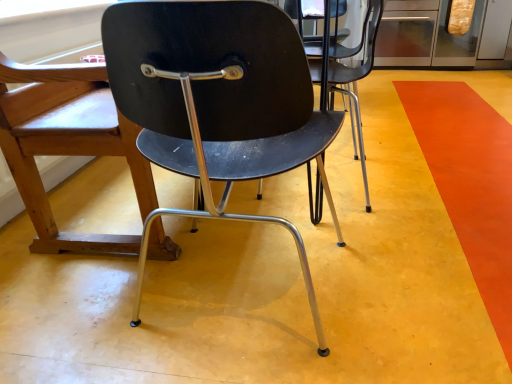
Question: Would you consider matte black chair at center, which is the 1th chair in back-to-front order, to be distant from orange matte floor at lower right?

Choices:
 (A) yes
 (B) no

Answer: (A)

Question: Is matte black chair at center, the 2th chair when ordered from front to back, positioned behind orange matte floor at lower right?

Choices:
 (A) yes
 (B) no

Answer: (A)

Question: From the image's perspective, is matte black chair at center, the 2th chair when ordered from front to back, below orange matte floor at lower right?

Choices:
 (A) yes
 (B) no

Answer: (B)

Question: Is the surface of matte black chair at center, the 2th chair when ordered from front to back, in direct contact with orange matte floor at lower right?

Choices:
 (A) no
 (B) yes

Answer: (A)

Question: Does matte black chair at center, which is the 1th chair in back-to-front order, have a larger size compared to orange matte floor at lower right?

Choices:
 (A) yes
 (B) no

Answer: (A)

Question: Is matte black chair at center, which is the 1th chair in back-to-front order, looking in the opposite direction of orange matte floor at lower right?

Choices:
 (A) no
 (B) yes

Answer: (A)

Question: Does matte black chair at center, the 2th chair from the back, appear on the right side of matte black chair at center, the 2th chair when ordered from front to back?

Choices:
 (A) no
 (B) yes

Answer: (B)

Question: Is matte black chair at center, the 1th chair viewed from the front, behind matte black chair at center, which is the 1th chair in back-to-front order?

Choices:
 (A) no
 (B) yes

Answer: (A)

Question: Is matte black chair at center, the 2th chair from the back, taller than matte black chair at center, the 2th chair when ordered from front to back?

Choices:
 (A) no
 (B) yes

Answer: (A)

Question: From the image's perspective, is matte black chair at center, the 2th chair from the back, over matte black chair at center, which is the 1th chair in back-to-front order?

Choices:
 (A) no
 (B) yes

Answer: (A)

Question: Does matte black chair at center, the 1th chair viewed from the front, have a smaller size compared to matte black chair at center, which is the 1th chair in back-to-front order?

Choices:
 (A) no
 (B) yes

Answer: (B)

Question: Can you confirm if matte black chair at center, the 2th chair from the back, is shorter than matte black chair at center, the 2th chair when ordered from front to back?

Choices:
 (A) yes
 (B) no

Answer: (A)

Question: Can you confirm if orange matte floor at lower right is smaller than matte black chair at center, which is the 1th chair in back-to-front order?

Choices:
 (A) no
 (B) yes

Answer: (B)